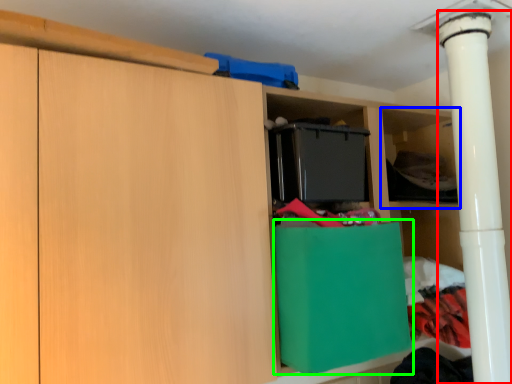
Question: Estimate the real-world distances between objects in this image. Which object is closer to pillar (highlighted by a red box), shelf (highlighted by a blue box) or cabinetry (highlighted by a green box)?

Choices:
 (A) shelf
 (B) cabinetry

Answer: (A)